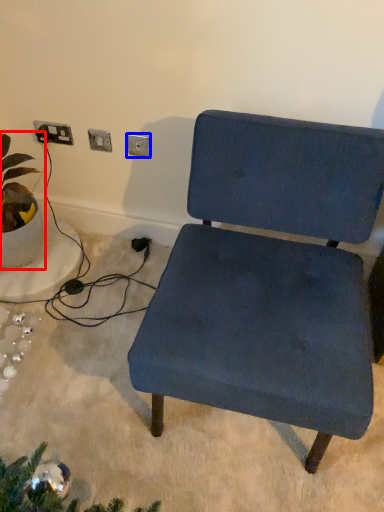
Question: Which of the following is the farthest to the observer, houseplant (highlighted by a red box) or electric outlet (highlighted by a blue box)?

Choices:
 (A) houseplant
 (B) electric outlet

Answer: (B)